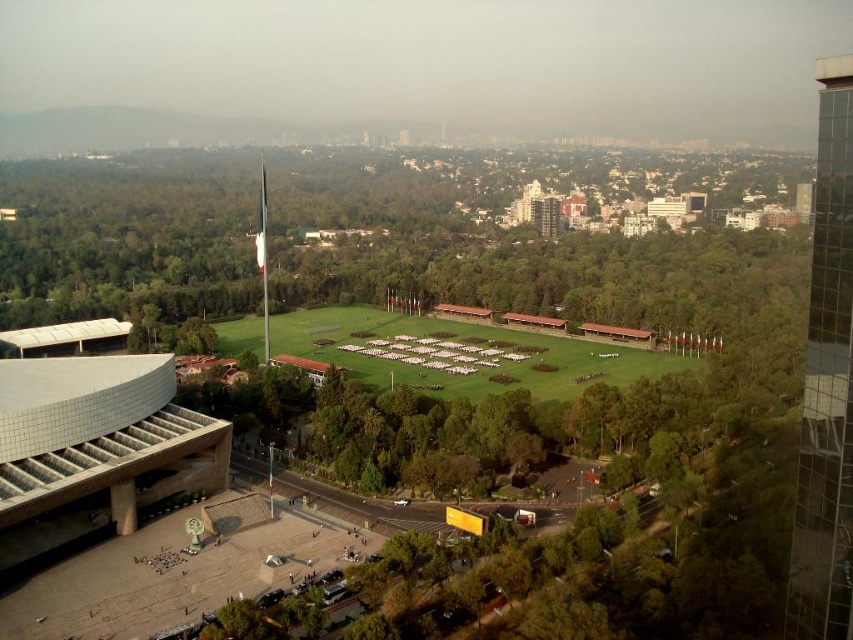
Who is positioned more to the left, green leafy tree at center or green grassy field at center?

green leafy tree at center is more to the left.

Is green leafy tree at center bigger than green grassy field at center?

Yes.

Who is more forward, [465,440] or [532,348]?

Point [465,440]

This screenshot has height=640, width=853. I want to click on green leafy tree at center, so click(x=521, y=308).